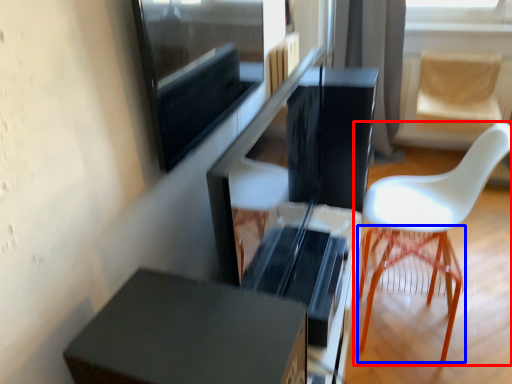
Question: Which of the following is the farthest to the observer, chair (highlighted by a red box) or bar stool (highlighted by a blue box)?

Choices:
 (A) chair
 (B) bar stool

Answer: (B)